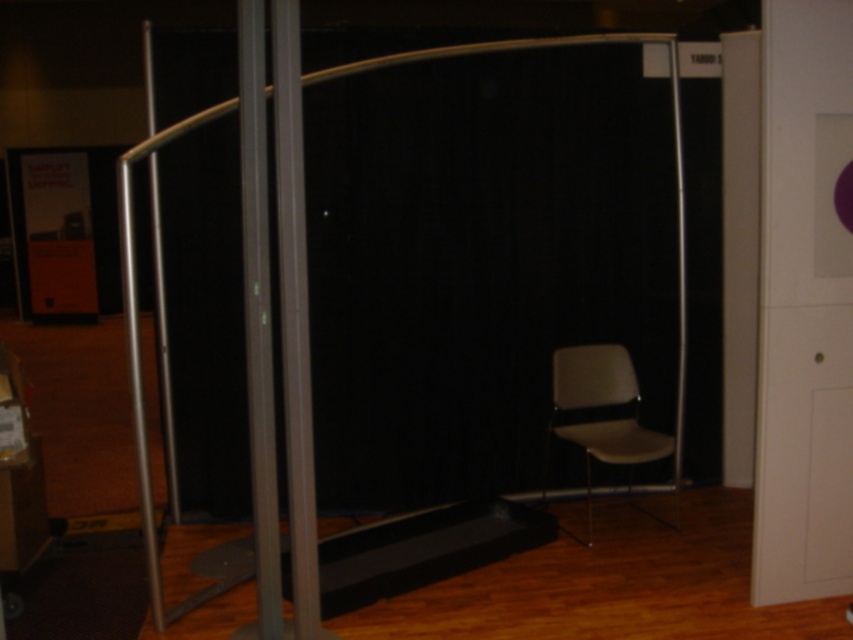
Between metallic gray pole at center and gray plastic swivel chair at right, which one appears on the left side from the viewer's perspective?

metallic gray pole at center

Between point (308, 346) and point (619, 346), which one is positioned in front?

Point (308, 346)

Find the location of a particular element. This screenshot has height=640, width=853. metallic gray pole at center is located at coordinates (294, 320).

Does transparent glass door at center have a larger size compared to metallic gray pole at center?

Yes.

Is transparent glass door at center to the left of metallic gray pole at center from the viewer's perspective?

Indeed, transparent glass door at center is positioned on the left side of metallic gray pole at center.

The image size is (853, 640). What do you see at coordinates (140, 365) in the screenshot?
I see `transparent glass door at center` at bounding box center [140, 365].

Identify the location of transparent glass door at center. The height and width of the screenshot is (640, 853). coord(140,365).

Is metallic silver pole at center to the left of gray plastic swivel chair at right from the viewer's perspective?

Correct, you'll find metallic silver pole at center to the left of gray plastic swivel chair at right.

Can you confirm if metallic silver pole at center is positioned below gray plastic swivel chair at right?

No, metallic silver pole at center is not below gray plastic swivel chair at right.

Where is `metallic silver pole at center`? The image size is (853, 640). metallic silver pole at center is located at coordinates pyautogui.click(x=258, y=324).

This screenshot has height=640, width=853. What are the coordinates of `metallic silver pole at center` in the screenshot? It's located at 258,324.